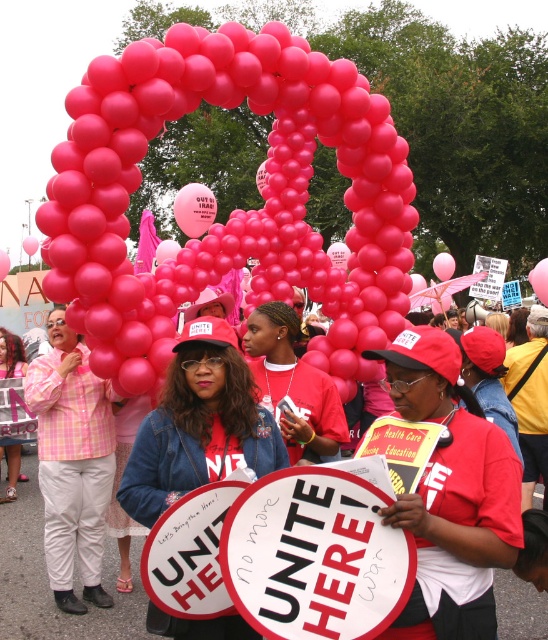
You are a photographer at the protest scene. You want to take a photo of the pink balloons at center and the matte pink shirt at center. Which object should you focus on first if you want to capture both in a single frame without moving the camera?

The pink balloons at center is positioned over the matte pink shirt at center, so you should focus on the pink balloons at center first to ensure both are in focus.

You are a photographer trying to capture a clear shot of both the pink balloons at center and the matte red shirt at center in the protest scene. Which object should you focus on first if you want to ensure both are in sharp focus?

The pink balloons at center has a smaller size compared to matte red shirt at center, so you should focus on the smaller pink balloons at center first to ensure depth of field includes both objects.